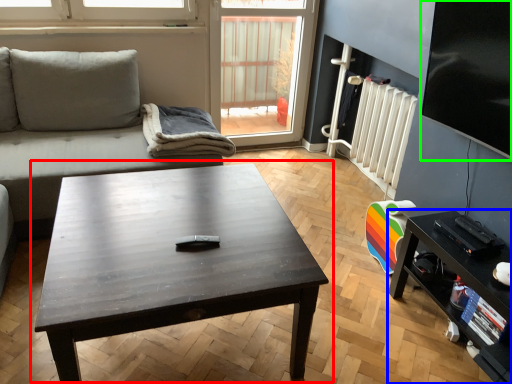
Question: Considering the real-world distances, which object is farthest from coffee table (highlighted by a red box)? table (highlighted by a blue box) or window screen (highlighted by a green box)?

Choices:
 (A) table
 (B) window screen

Answer: (B)